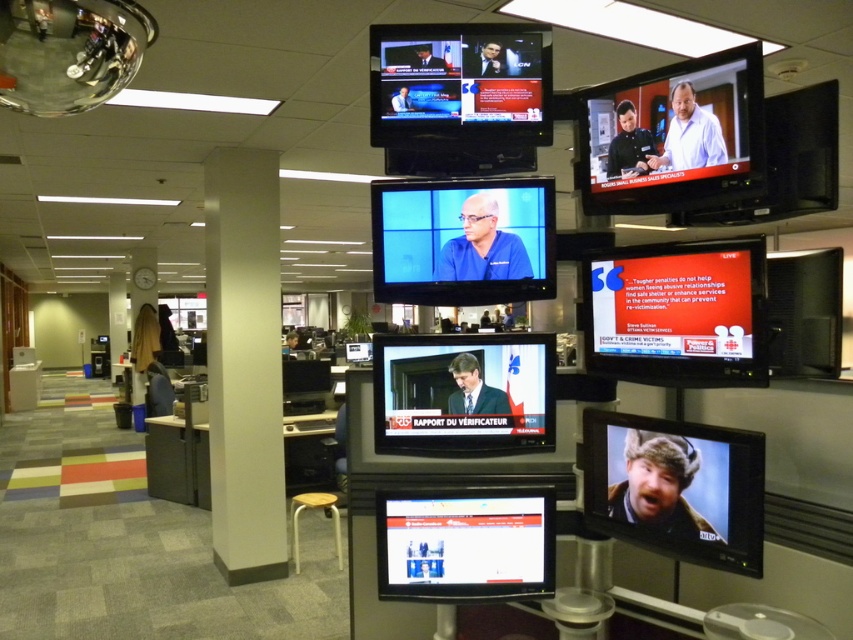
Question: Among these points, which one is farthest from the camera?

Choices:
 (A) (260, 385)
 (B) (395, 227)

Answer: (A)

Question: Which point is farther to the camera?

Choices:
 (A) white smooth pillar at center
 (B) blue fabric screen at center

Answer: (A)

Question: Does white smooth pillar at center come behind blue fabric screen at center?

Choices:
 (A) no
 (B) yes

Answer: (B)

Question: Does white smooth pillar at center appear over blue fabric screen at center?

Choices:
 (A) yes
 (B) no

Answer: (B)

Question: In this image, where is white smooth pillar at center located relative to blue fabric screen at center?

Choices:
 (A) right
 (B) left

Answer: (B)

Question: Among these points, which one is farthest from the camera?

Choices:
 (A) (239, 298)
 (B) (440, 276)

Answer: (A)